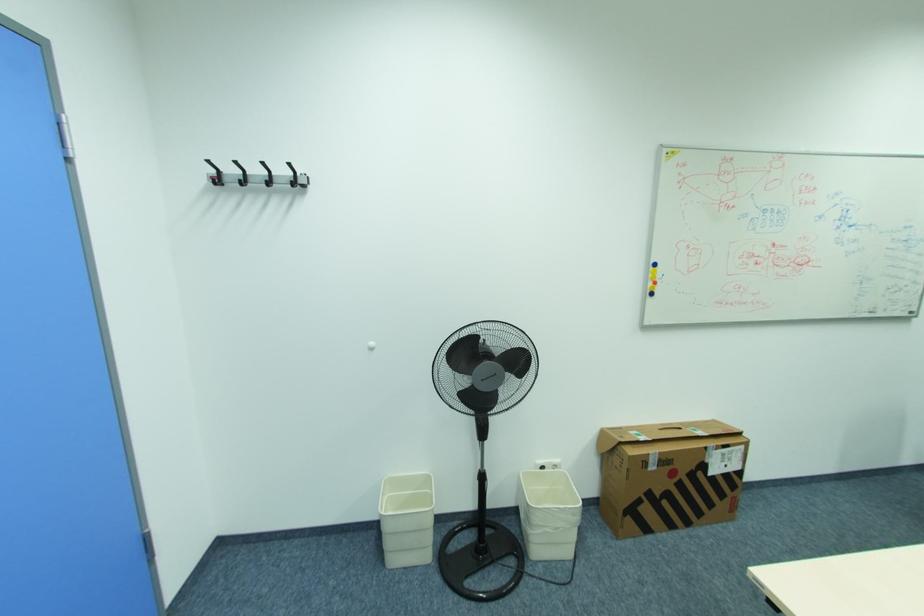
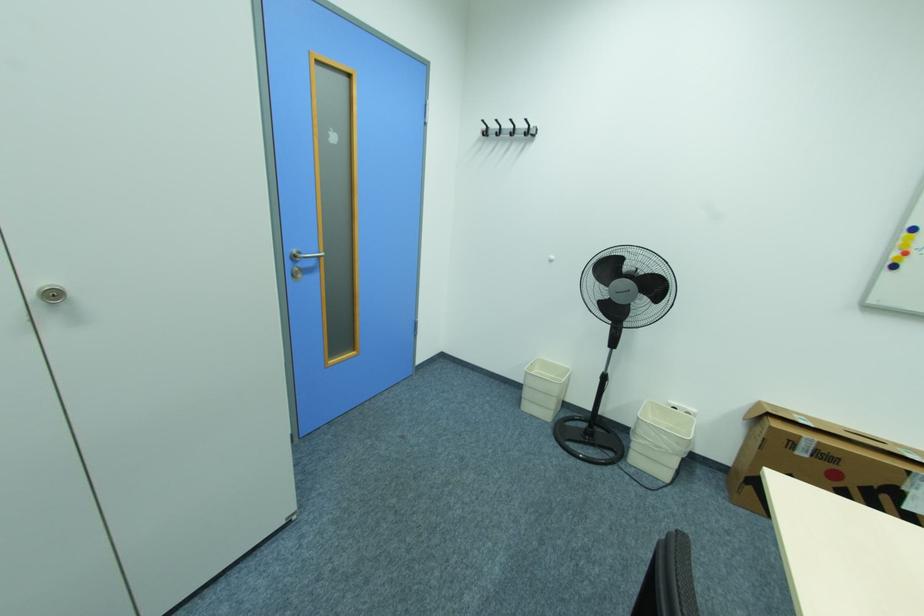
Find the pixel in the second image that matches point (653, 455) in the first image.

(805, 437)